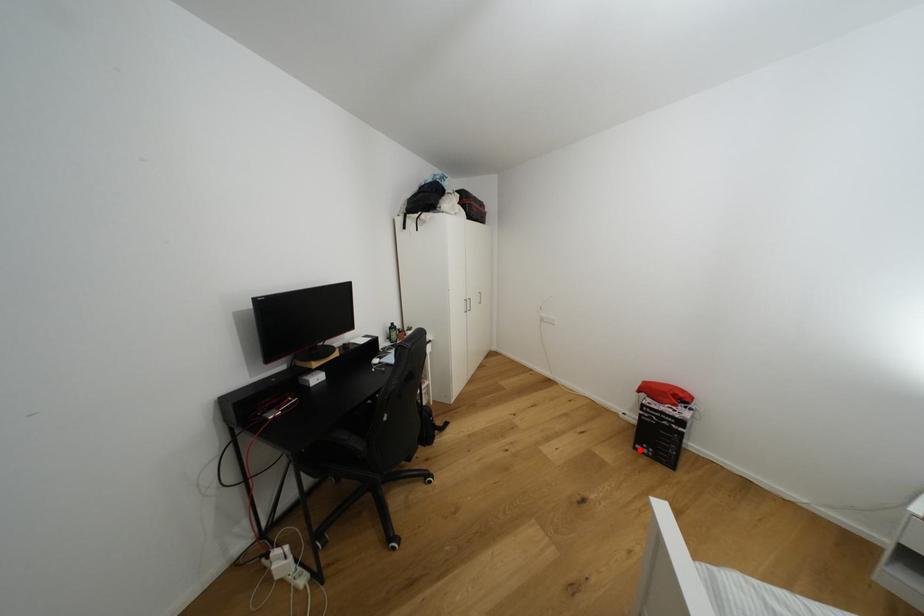
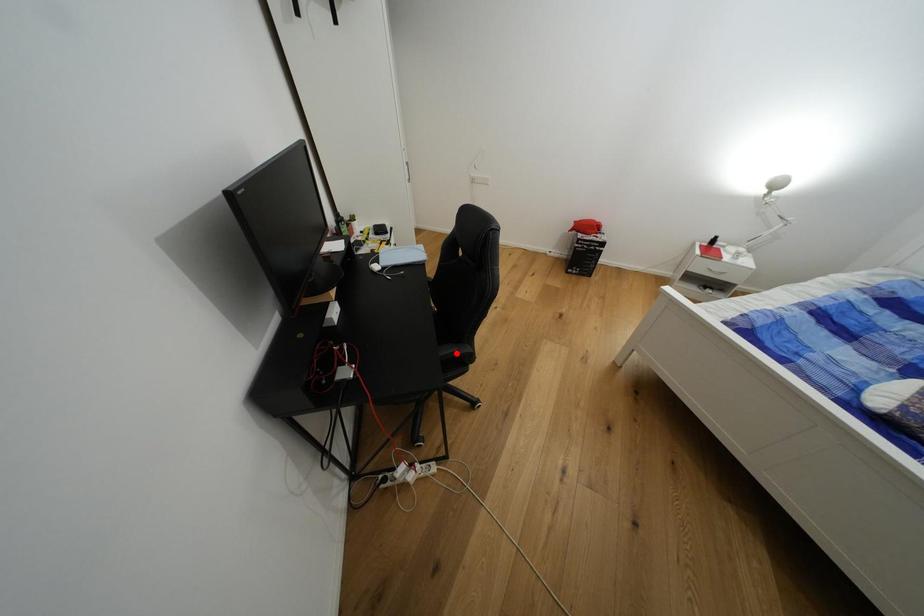
I am providing you with two images of the same scene from different viewpoints. A red point is marked on the first image and another point is marked on the second image. Does the point marked in image1 correspond to the same location as the one in image2?

No